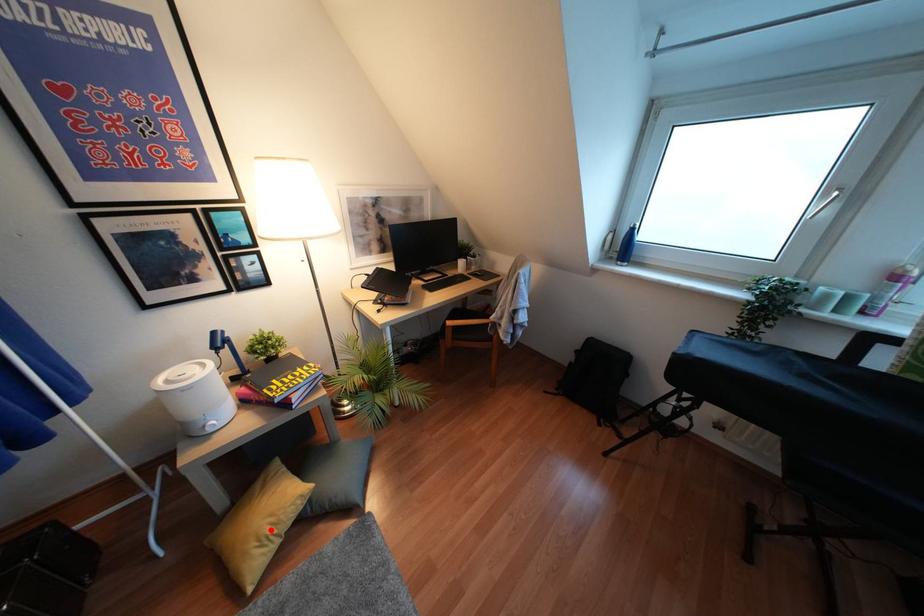
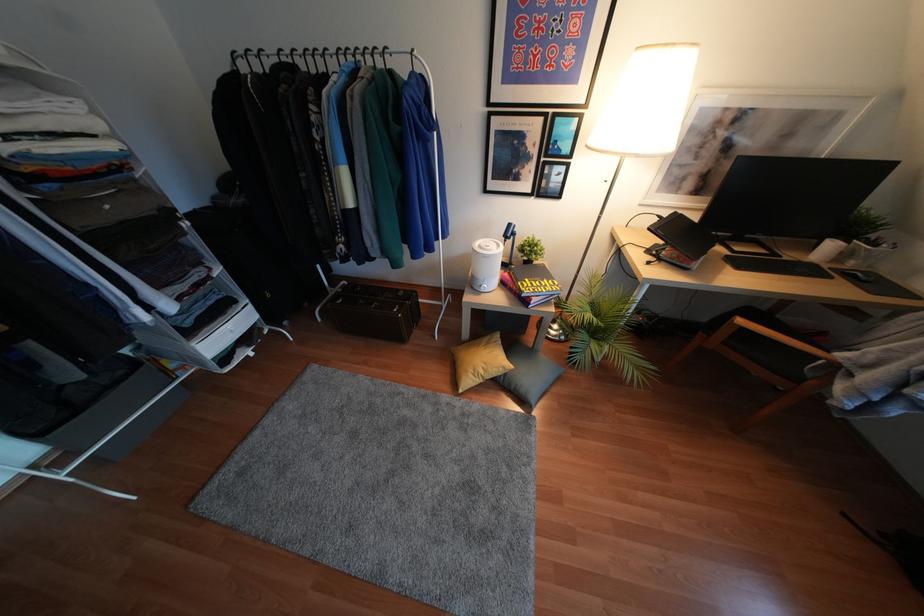
Question: A red point is marked in image1. In image2, is the corresponding 3D point closer to the camera or farther? Reply with the corresponding letter.

Choices:
 (A) The corresponding 3D point is closer.
 (B) The corresponding 3D point is farther.

Answer: (B)